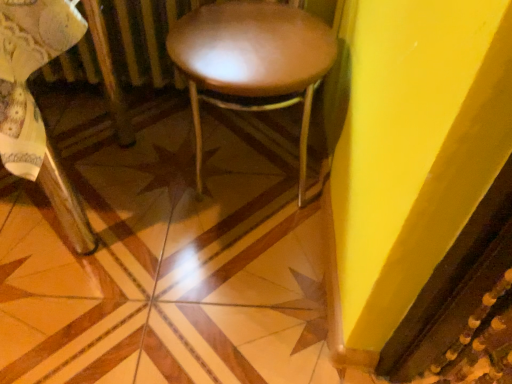
The width and height of the screenshot is (512, 384). I want to click on leather-like brown stool at center, so click(x=252, y=62).

Describe the element at coordinates (165, 255) in the screenshot. I see `wooden floor at center` at that location.

Where is `wooden chair at center`? This screenshot has height=384, width=512. wooden chair at center is located at coordinates (35, 102).

From the image's perspective, is leather-like brown stool at center beneath wooden chair at center?

No.

Between leather-like brown stool at center and wooden chair at center, which one has smaller size?

leather-like brown stool at center.

Is wooden chair at center at the back of leather-like brown stool at center?

No, leather-like brown stool at center's orientation is not away from wooden chair at center.

Is there a large distance between wooden floor at center and wooden chair at center?

wooden floor at center is actually quite close to wooden chair at center.

In the scene shown: Can you confirm if wooden floor at center is wider than wooden chair at center?

Indeed, wooden floor at center has a greater width compared to wooden chair at center.

Is wooden floor at center situated inside wooden chair at center or outside?

wooden floor at center is not inside wooden chair at center, it's outside.

Based on the photo, in the image, is wooden floor at center positioned in front of or behind wooden chair at center?

Clearly, wooden floor at center is behind wooden chair at center.

Is wooden chair at center taller or shorter than leather-like brown stool at center?

In the image, wooden chair at center appears to be taller than leather-like brown stool at center.

Is wooden chair at center aimed at leather-like brown stool at center?

No.

Considering the relative positions of wooden chair at center and leather-like brown stool at center in the image provided, is wooden chair at center to the left of leather-like brown stool at center from the viewer's perspective?

Correct, you'll find wooden chair at center to the left of leather-like brown stool at center.

Does wooden chair at center appear on the left side of wooden floor at center?

Indeed, wooden chair at center is positioned on the left side of wooden floor at center.

Considering the relative sizes of wooden chair at center and wooden floor at center in the image provided, is wooden chair at center thinner than wooden floor at center?

Yes.

Which object is closer to the camera taking this photo, wooden chair at center or wooden floor at center?

wooden chair at center is closer to the camera.

Can you tell me how much wooden chair at center and wooden floor at center differ in facing direction?

There is a 90.9-degree angle between the facing directions of wooden chair at center and wooden floor at center.

Does wooden floor at center turn towards leather-like brown stool at center?

No, wooden floor at center is not oriented towards leather-like brown stool at center.

Who is taller, wooden floor at center or leather-like brown stool at center?

Standing taller between the two is leather-like brown stool at center.

Is wooden floor at center thinner than leather-like brown stool at center?

Incorrect, the width of wooden floor at center is not less than that of leather-like brown stool at center.

You are a GUI agent. You are given a task and a screenshot of the screen. Output one action in this format:
    pyautogui.click(x=<x>, y=<y>)
    Task: Click on the tile located on the left of leather-like brown stool at center
    The image size is (512, 384).
    Given the screenshot: What is the action you would take?
    pyautogui.click(x=165, y=255)

From their relative heights in the image, would you say leather-like brown stool at center is taller or shorter than wooden floor at center?

Clearly, leather-like brown stool at center is taller compared to wooden floor at center.

Can you confirm if leather-like brown stool at center is positioned to the right of wooden floor at center?

Indeed, leather-like brown stool at center is positioned on the right side of wooden floor at center.

Between leather-like brown stool at center and wooden floor at center, which one is positioned behind?

wooden floor at center is behind.

Locate an element on the screen. This screenshot has height=384, width=512. chair below the leather-like brown stool at center (from the image's perspective) is located at coordinates (35, 102).

You are a GUI agent. You are given a task and a screenshot of the screen. Output one action in this format:
    pyautogui.click(x=<x>, y=<y>)
    Task: Click on the chair that appears on the left of wooden floor at center
    The width and height of the screenshot is (512, 384).
    Given the screenshot: What is the action you would take?
    pyautogui.click(x=35, y=102)

When comparing their distances from wooden chair at center, does leather-like brown stool at center or wooden floor at center seem closer?

wooden floor at center is closer to wooden chair at center.

Which object lies further to the anchor point wooden floor at center, leather-like brown stool at center or wooden chair at center?

leather-like brown stool at center is further to wooden floor at center.

Looking at the image, which one is located further to wooden floor at center, wooden chair at center or leather-like brown stool at center?

leather-like brown stool at center is further to wooden floor at center.

From the image, which object appears to be nearer to leather-like brown stool at center, wooden chair at center or wooden floor at center?

wooden floor at center is positioned closer to the anchor leather-like brown stool at center.

Based on their spatial positions, is wooden floor at center or leather-like brown stool at center closer to wooden chair at center?

wooden floor at center is positioned closer to the anchor wooden chair at center.

Looking at the image, which one is located closer to leather-like brown stool at center, wooden floor at center or wooden chair at center?

Among the two, wooden floor at center is located nearer to leather-like brown stool at center.

The image size is (512, 384). Find the location of `tile situated between wooden chair at center and leather-like brown stool at center from left to right`. tile situated between wooden chair at center and leather-like brown stool at center from left to right is located at coordinates (165, 255).